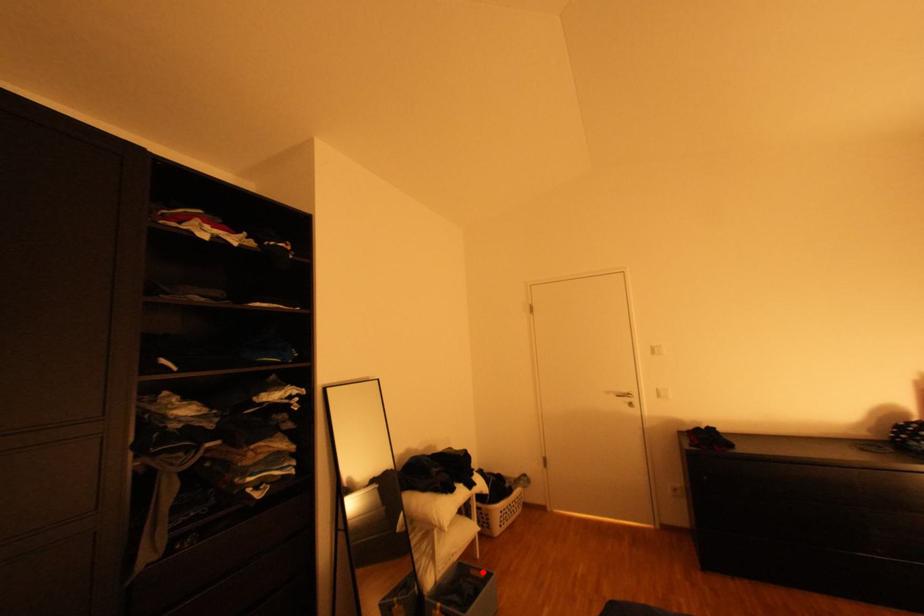
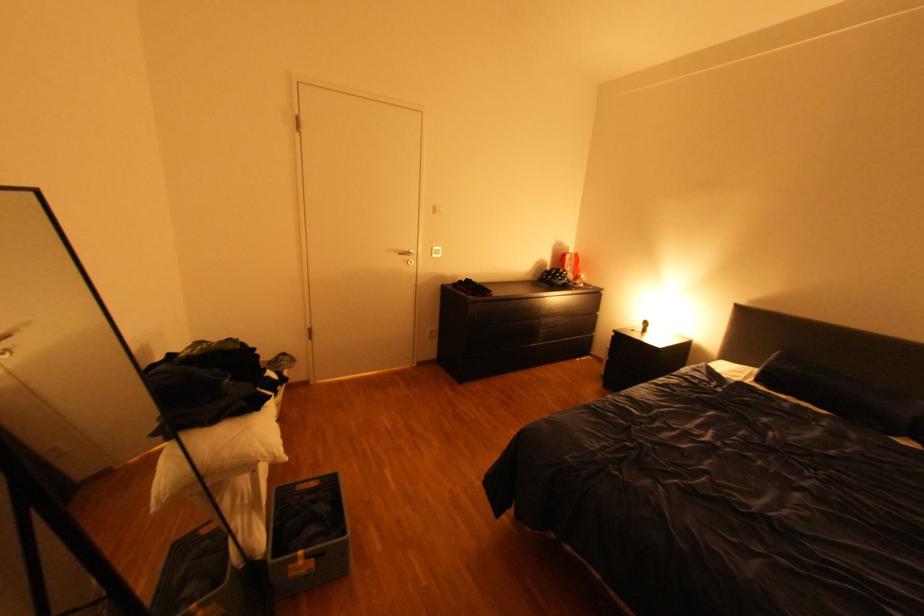
Question: A red point is marked in image1. In image2, is the corresponding 3D point closer to the camera or farther? Reply with the corresponding letter.

Choices:
 (A) The corresponding 3D point is closer.
 (B) The corresponding 3D point is farther.

Answer: (B)